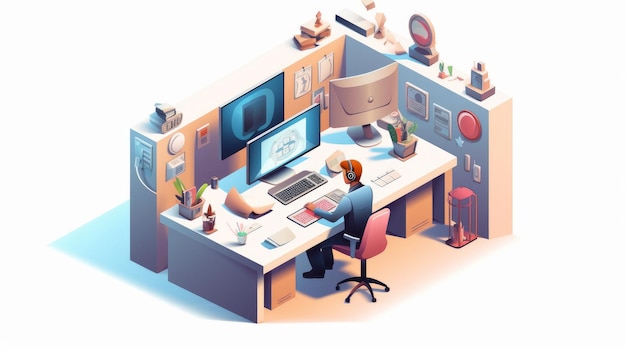
The image size is (626, 351). I want to click on cord, so click(141, 181).